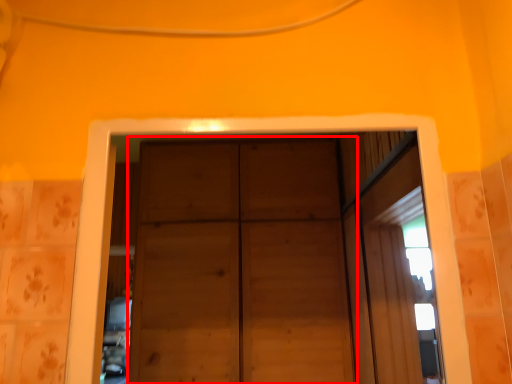
Question: From the image's perspective, what is the correct spatial positioning of door (annotated by the red box) in reference to window?

Choices:
 (A) above
 (B) below

Answer: (B)